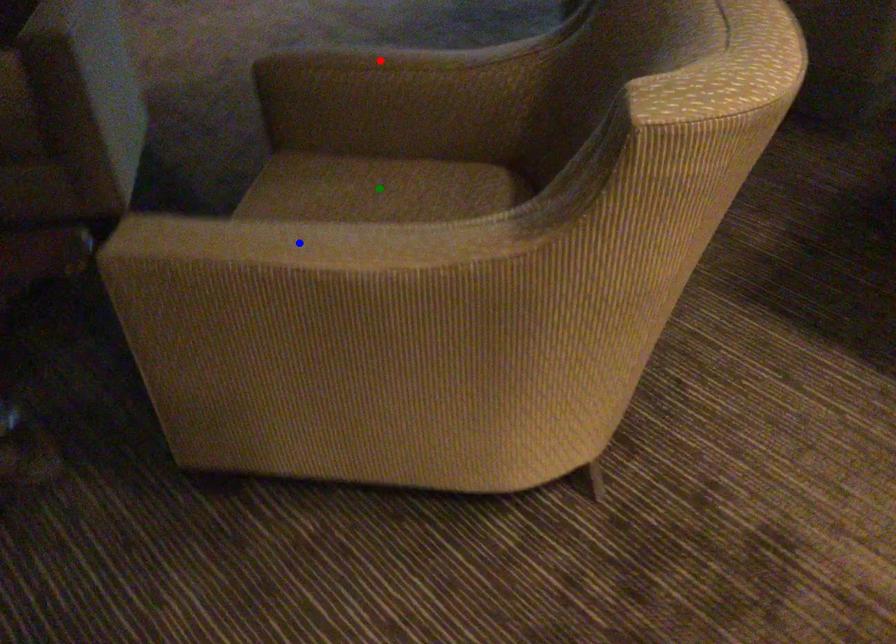
Order these from nearest to farthest:
1. blue point
2. green point
3. red point

1. red point
2. green point
3. blue point